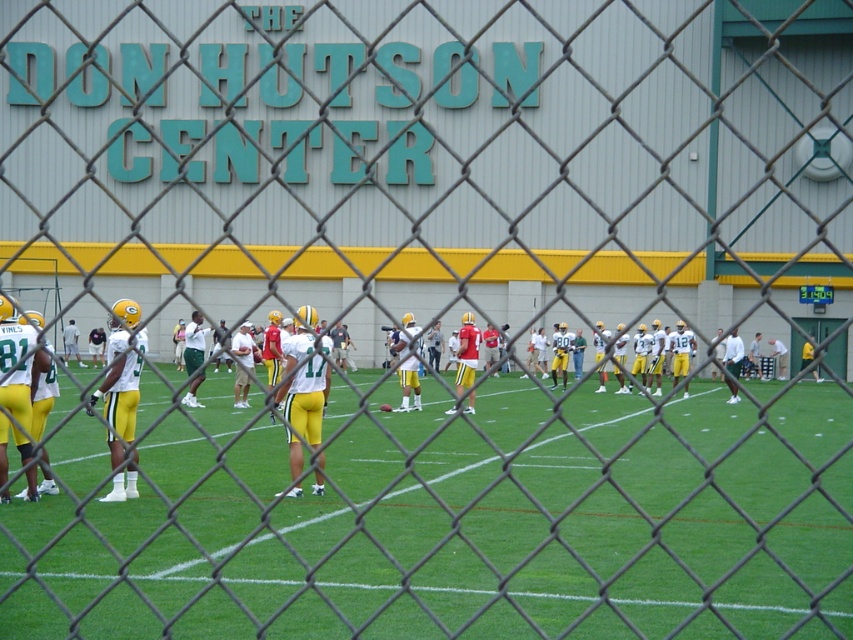
Question: Which point is closer to the camera taking this photo?

Choices:
 (A) (15, 483)
 (B) (746, 612)

Answer: (B)

Question: Is yellow/yellow-green uniform at center thinner than matte green uniform at center?

Choices:
 (A) yes
 (B) no

Answer: (A)

Question: Which point is closer to the camera taking this photo?

Choices:
 (A) (300, 454)
 (B) (780, 632)

Answer: (B)

Question: Is yellow/yellow-green uniform at center thinner than matte green uniform at center?

Choices:
 (A) yes
 (B) no

Answer: (A)

Question: Is yellow/yellow-green uniform at center in front of matte green uniform at center?

Choices:
 (A) no
 (B) yes

Answer: (A)